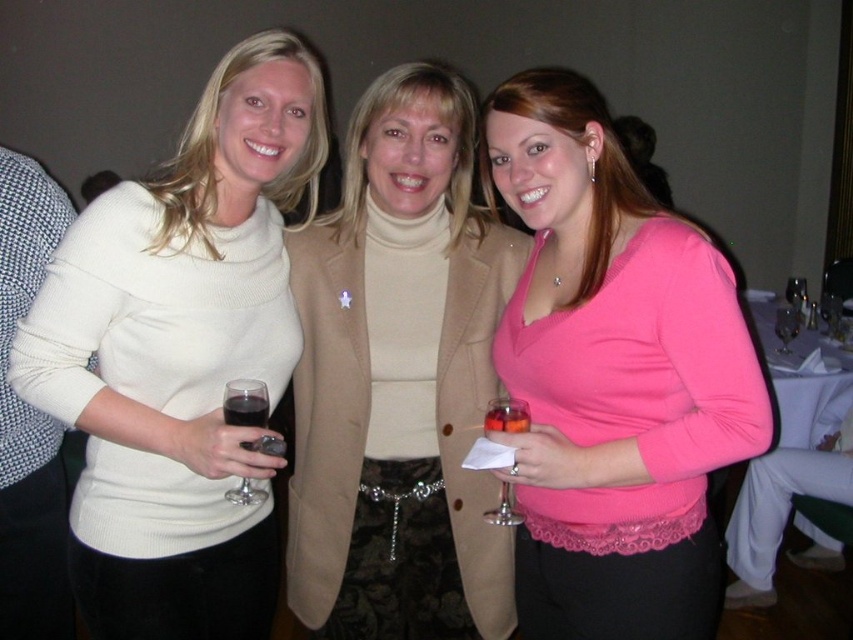
You are a photographer at an event and need to ensure that the pink matte sweater at center and the transparent plastic wine glass at center are both visible in the photo. Based on their sizes, which object might require more careful framing to ensure it stands out?

The pink matte sweater at center might be wider than the transparent plastic wine glass at center, so it could require more attention to framing to ensure it doesn

You are at a party and want to grab the translucent glass wine glass at center without touching the beige turtleneck sweater at center. Is it possible based on their positions?

The translucent glass wine glass at center is behind the beige turtleneck sweater at center, so you can reach it without touching the sweater.